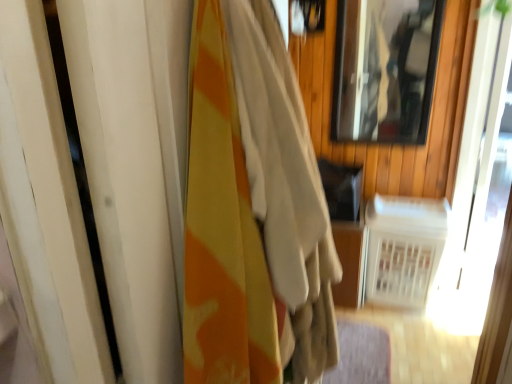
I want to click on camouflage fabric curtain at left, so click(x=253, y=209).

Locate an element on the screen. The width and height of the screenshot is (512, 384). clear glass mirror at upper right is located at coordinates (385, 69).

Consider the image. What is the approximate width of white plastic radiator at lower right?

The width of white plastic radiator at lower right is 14.83 inches.

What are the coordinates of `camouflage fabric curtain at left` in the screenshot? It's located at (253, 209).

Is point (396, 213) behind point (420, 71)?

Yes.

Identify the location of radiator that is on the right side of clear glass mirror at upper right. The height and width of the screenshot is (384, 512). (404, 248).

Can you confirm if white plastic radiator at lower right is bigger than clear glass mirror at upper right?

Indeed, white plastic radiator at lower right has a larger size compared to clear glass mirror at upper right.

Consider the image. Is white plastic radiator at lower right turned away from clear glass mirror at upper right?

Result: No, white plastic radiator at lower right is not facing the opposite direction of clear glass mirror at upper right.

Find the location of a particular element. curtain below the clear glass mirror at upper right (from a real-world perspective) is located at coordinates (253, 209).

Which object is more forward, clear glass mirror at upper right or camouflage fabric curtain at left?

camouflage fabric curtain at left is more forward.

From a real-world perspective, relative to camouflage fabric curtain at left, is clear glass mirror at upper right vertically above or below?

Clearly, from a real-world perspective, clear glass mirror at upper right is above camouflage fabric curtain at left.

Could you tell me if clear glass mirror at upper right is turned towards camouflage fabric curtain at left?

Yes, clear glass mirror at upper right is turned towards camouflage fabric curtain at left.

Consider the image. Would you say clear glass mirror at upper right is inside or outside white plastic radiator at lower right?

clear glass mirror at upper right is spatially situated outside white plastic radiator at lower right.

From a real-world perspective, is clear glass mirror at upper right on white plastic radiator at lower right?

Indeed, from a real-world perspective, clear glass mirror at upper right stands above white plastic radiator at lower right.

Considering the relative sizes of clear glass mirror at upper right and white plastic radiator at lower right in the image provided, is clear glass mirror at upper right smaller than white plastic radiator at lower right?

Indeed, clear glass mirror at upper right has a smaller size compared to white plastic radiator at lower right.

Measure the distance between clear glass mirror at upper right and white plastic radiator at lower right.

25.88 inches.

From a real-world perspective, is white plastic radiator at lower right positioned over camouflage fabric curtain at left based on gravity?

No, from a real-world perspective, white plastic radiator at lower right is not above camouflage fabric curtain at left.

Locate an element on the screen. curtain above the white plastic radiator at lower right (from a real-world perspective) is located at coordinates (253, 209).

How many degrees apart are the facing directions of white plastic radiator at lower right and camouflage fabric curtain at left?

There is a 87-degree angle between the facing directions of white plastic radiator at lower right and camouflage fabric curtain at left.

Between point (216, 89) and point (379, 134), which one is positioned in front?

The point (216, 89) is closer to the camera.

Who is shorter, camouflage fabric curtain at left or clear glass mirror at upper right?

With less height is clear glass mirror at upper right.

Is camouflage fabric curtain at left positioned before clear glass mirror at upper right?

Yes, the depth of camouflage fabric curtain at left is less than that of clear glass mirror at upper right.

Who is smaller, camouflage fabric curtain at left or clear glass mirror at upper right?

Smaller between the two is clear glass mirror at upper right.

Choose the correct answer: Is camouflage fabric curtain at left inside white plastic radiator at lower right or outside it?

camouflage fabric curtain at left is spatially situated outside white plastic radiator at lower right.

From the image's perspective, is camouflage fabric curtain at left over white plastic radiator at lower right?

Yes, from the image's perspective, camouflage fabric curtain at left is above white plastic radiator at lower right.

The height and width of the screenshot is (384, 512). I want to click on mirror above the white plastic radiator at lower right (from a real-world perspective), so click(x=385, y=69).

Locate an element on the screen. The image size is (512, 384). mirror located behind the camouflage fabric curtain at left is located at coordinates (385, 69).

Estimate the real-world distances between objects in this image. Which object is closer to clear glass mirror at upper right, white plastic radiator at lower right or camouflage fabric curtain at left?

The object closer to clear glass mirror at upper right is white plastic radiator at lower right.

When comparing their distances from white plastic radiator at lower right, does clear glass mirror at upper right or camouflage fabric curtain at left seem further?

Based on the image, camouflage fabric curtain at left appears to be further to white plastic radiator at lower right.

Estimate the real-world distances between objects in this image. Which object is further from clear glass mirror at upper right, camouflage fabric curtain at left or white plastic radiator at lower right?

Based on the image, camouflage fabric curtain at left appears to be further to clear glass mirror at upper right.

When comparing their distances from camouflage fabric curtain at left, does white plastic radiator at lower right or clear glass mirror at upper right seem further?

clear glass mirror at upper right lies further to camouflage fabric curtain at left than the other object.

When comparing their distances from camouflage fabric curtain at left, does clear glass mirror at upper right or white plastic radiator at lower right seem closer?

white plastic radiator at lower right lies closer to camouflage fabric curtain at left than the other object.

Looking at the image, which one is located closer to white plastic radiator at lower right, camouflage fabric curtain at left or clear glass mirror at upper right?

clear glass mirror at upper right is positioned closer to the anchor white plastic radiator at lower right.

Identify the location of mirror between camouflage fabric curtain at left and white plastic radiator at lower right along the z-axis. This screenshot has width=512, height=384. (385, 69).